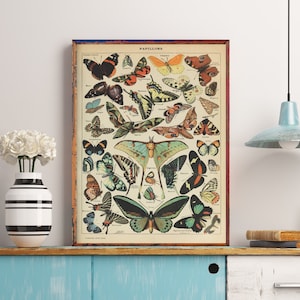
At what (x,y) coordinates should I click in order to perform the action: click on hanging light. Please return your answer as a coordinate pair (x, y). The width and height of the screenshot is (300, 300). Looking at the image, I should click on (290, 110).